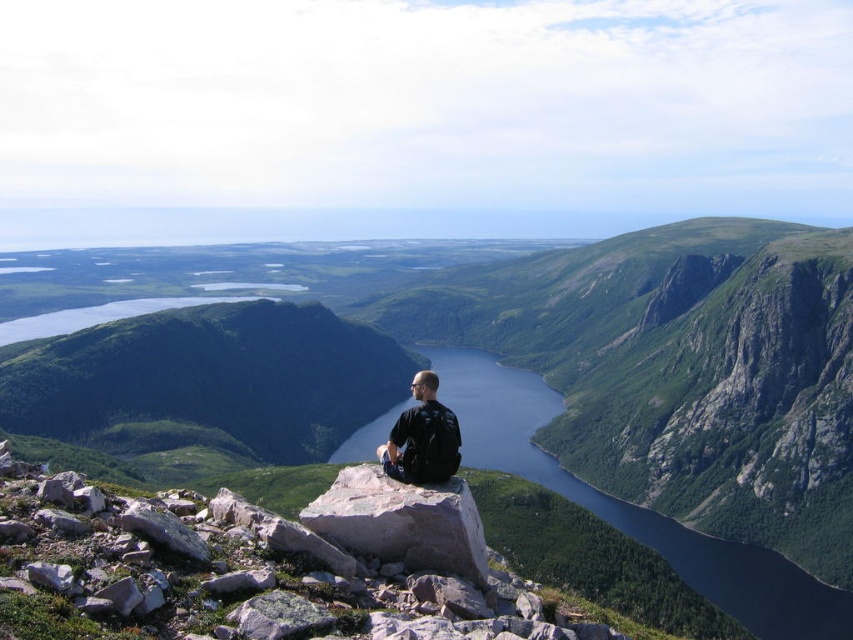
Question: Is green rocky mountain at center to the right of black fabric backpack at center from the viewer's perspective?

Choices:
 (A) no
 (B) yes

Answer: (A)

Question: Which object is the farthest from the gray rock at center?

Choices:
 (A) black fabric backpack at center
 (B) blue glassy water at center
 (C) green rocky mountain at center

Answer: (C)

Question: Can you confirm if blue glassy water at center is positioned to the left of black fabric backpack at center?

Choices:
 (A) no
 (B) yes

Answer: (A)

Question: Among these points, which one is farthest from the camera?

Choices:
 (A) (389, 436)
 (B) (782, 509)

Answer: (B)

Question: Considering the real-world distances, which object is farthest from the green rocky mountain at center?

Choices:
 (A) black fabric backpack at center
 (B) gray rock at center

Answer: (A)

Question: Does gray rock at center lie in front of black fabric backpack at center?

Choices:
 (A) no
 (B) yes

Answer: (B)